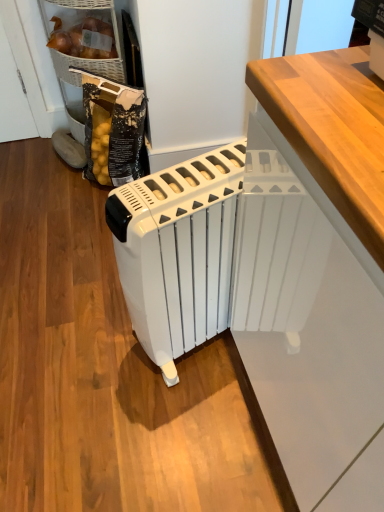
Question: Can you confirm if white plastic radiator at center is shorter than white glossy radiator at center, the 2th cabinetry from the back?

Choices:
 (A) yes
 (B) no

Answer: (A)

Question: Can you confirm if white plastic radiator at center is thinner than white glossy radiator at center, which ranks as the 2th cabinetry in left-to-right order?

Choices:
 (A) no
 (B) yes

Answer: (A)

Question: Is there a large distance between white plastic radiator at center and white glossy radiator at center, the 2th cabinetry from the back?

Choices:
 (A) yes
 (B) no

Answer: (B)

Question: Is white plastic radiator at center oriented away from white glossy radiator at center, the 2th cabinetry in the top-to-bottom sequence?

Choices:
 (A) no
 (B) yes

Answer: (A)

Question: From the image's perspective, does white plastic radiator at center appear higher than white glossy radiator at center, the first cabinetry when ordered from right to left?

Choices:
 (A) no
 (B) yes

Answer: (B)

Question: Is white plastic radiator at center taller or shorter than matte wicker basket at upper left, which ranks as the 1th cabinetry in back-to-front order?

Choices:
 (A) tall
 (B) short

Answer: (A)

Question: From the image's perspective, relative to matte wicker basket at upper left, acting as the first cabinetry starting from the top, is white plastic radiator at center above or below?

Choices:
 (A) below
 (B) above

Answer: (A)

Question: In the image, is white plastic radiator at center on the left side or the right side of matte wicker basket at upper left, which ranks as the 1th cabinetry in back-to-front order?

Choices:
 (A) left
 (B) right

Answer: (B)

Question: Looking at their shapes, would you say white plastic radiator at center is wider or thinner than matte wicker basket at upper left, the 2th cabinetry when ordered from front to back?

Choices:
 (A) wide
 (B) thin

Answer: (A)

Question: Would you say white glossy radiator at center, the 2th cabinetry from the back, is inside or outside matte wicker basket at upper left, acting as the first cabinetry starting from the top?

Choices:
 (A) inside
 (B) outside

Answer: (B)

Question: Is white glossy radiator at center, which is the first cabinetry from bottom to top, wider or thinner than matte wicker basket at upper left, arranged as the 1th cabinetry when viewed from the left?

Choices:
 (A) wide
 (B) thin

Answer: (A)

Question: Relative to matte wicker basket at upper left, arranged as the 1th cabinetry when viewed from the left, is white glossy radiator at center, the 2th cabinetry from the back, in front or behind?

Choices:
 (A) front
 (B) behind

Answer: (A)

Question: Considering the positions of point (357, 330) and point (64, 58), is point (357, 330) closer or farther from the camera than point (64, 58)?

Choices:
 (A) farther
 (B) closer

Answer: (B)

Question: Considering the positions of matte wicker basket at upper left, placed as the 2th cabinetry when sorted from bottom to top, and white plastic radiator at center in the image, is matte wicker basket at upper left, placed as the 2th cabinetry when sorted from bottom to top, bigger or smaller than white plastic radiator at center?

Choices:
 (A) big
 (B) small

Answer: (B)

Question: Is matte wicker basket at upper left, placed as the 2th cabinetry when sorted from bottom to top, situated inside white plastic radiator at center or outside?

Choices:
 (A) inside
 (B) outside

Answer: (B)